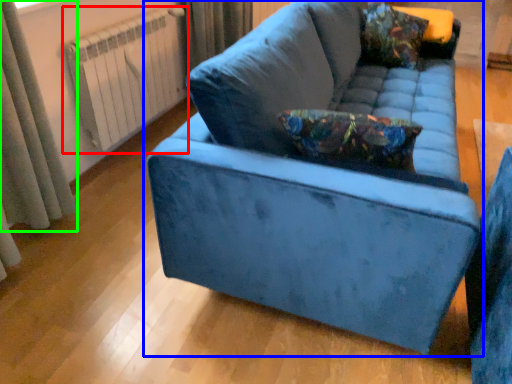
Question: Considering the real-world distances, which object is farthest from radiator (highlighted by a red box)? studio couch (highlighted by a blue box) or curtain (highlighted by a green box)?

Choices:
 (A) studio couch
 (B) curtain

Answer: (A)